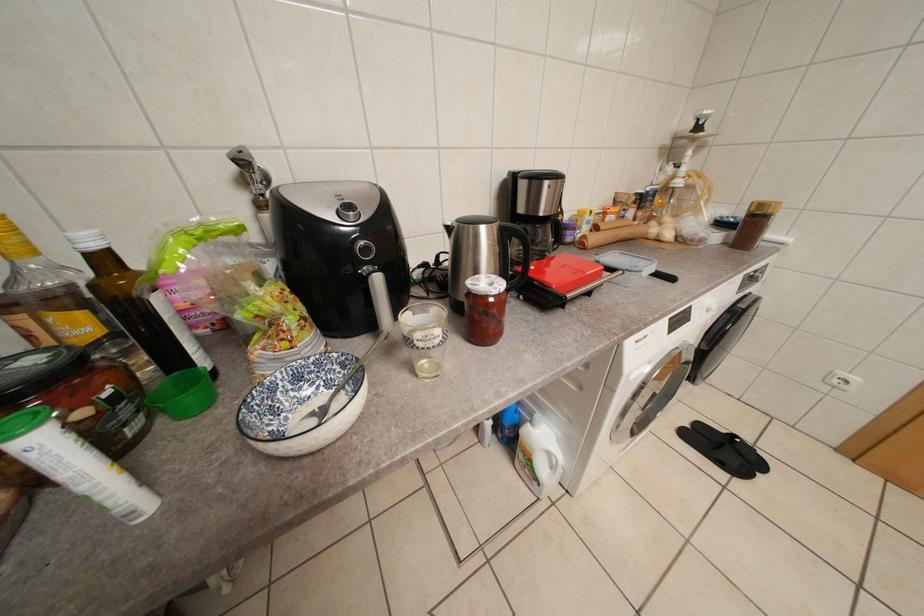
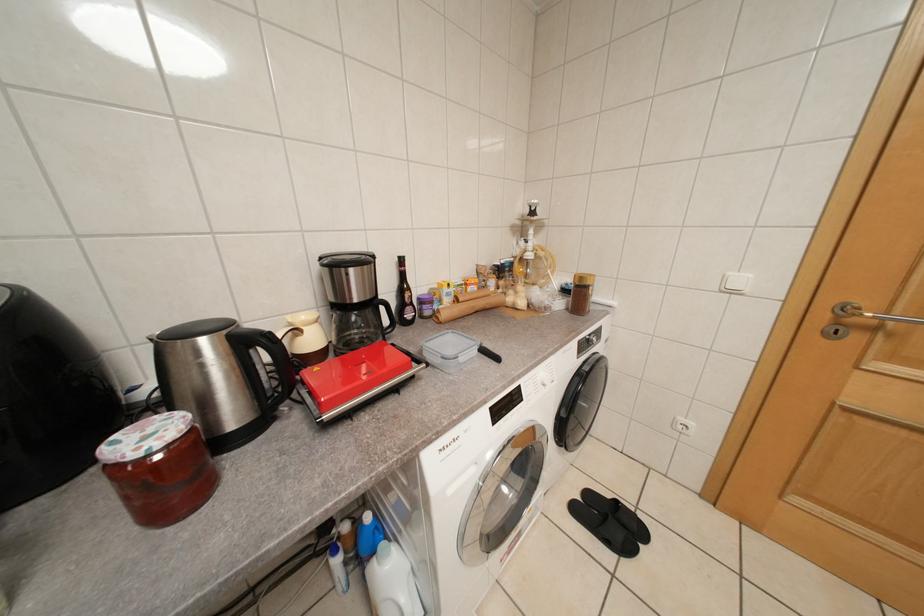
Question: What movement of the cameraman would produce the second image?

Choices:
 (A) Left
 (B) Right
 (C) Forward
 (D) Backward

Answer: (B)